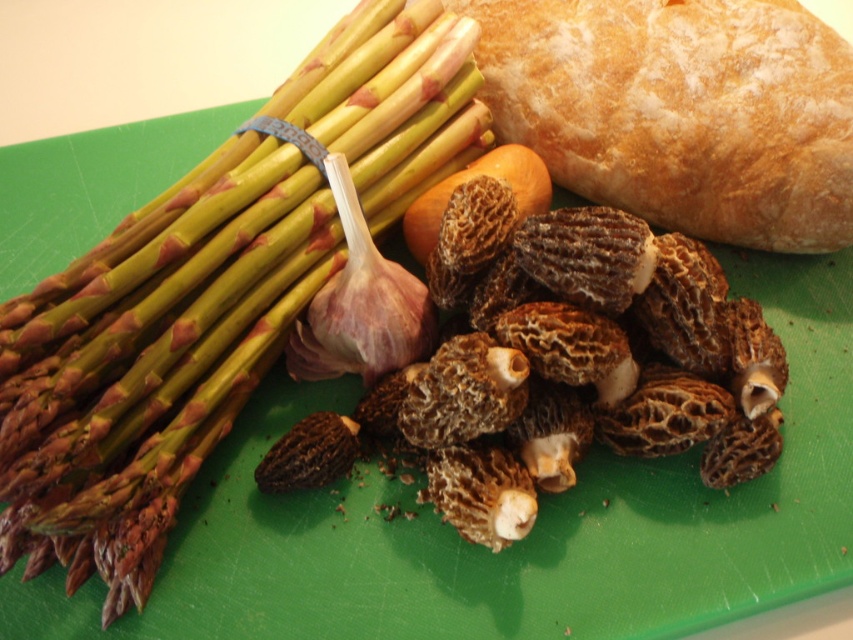
You are holding a camera 3.5 feet away from the green matte asparagus at left. Based on the scene description, can you confirm if you are positioned closer or farther than the recommended distance for capturing the asparagus in focus?

The green matte asparagus at left is 3.35 feet away from the camera. Since you are holding the camera 3.5 feet away, you are positioned slightly farther than the recommended distance of 3.35 feet.

You are a chef preparing a dish and need to choose between the green matte asparagus at left and the golden brown crusty loaf at upper right. Which object is bigger in size?

The green matte asparagus at left has a larger size compared to the golden brown crusty loaf at upper right, so the green matte asparagus at left is bigger.